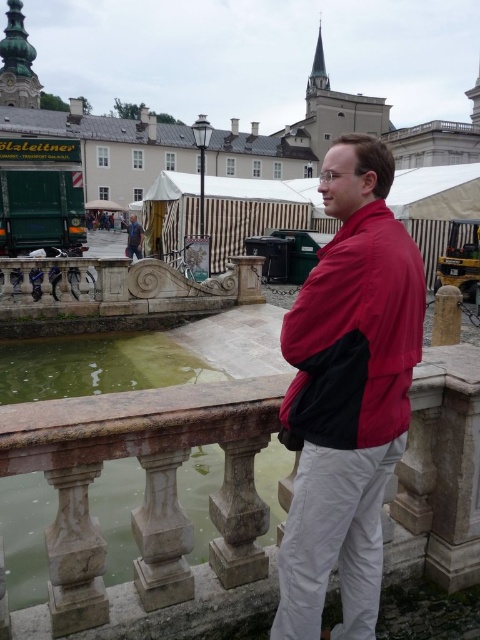
Question: Does red matte shirt at center have a smaller size compared to blue denim jeans at lower left?

Choices:
 (A) yes
 (B) no

Answer: (A)

Question: Is red matte shirt at center positioned before green stone water at lower left?

Choices:
 (A) no
 (B) yes

Answer: (B)

Question: Which point is closer to the camera?

Choices:
 (A) (330, 349)
 (B) (22, 568)
 (C) (398, 333)
 (D) (141, 252)

Answer: (A)

Question: Considering the real-world distances, which object is farthest from the green stone water at lower left?

Choices:
 (A) red matte jacket at center
 (B) blue denim jeans at lower left

Answer: (B)

Question: Which object appears farthest from the camera in this image?

Choices:
 (A) red matte shirt at center
 (B) green stone water at lower left

Answer: (B)

Question: Does green stone water at lower left have a greater width compared to blue denim jeans at lower left?

Choices:
 (A) no
 (B) yes

Answer: (A)